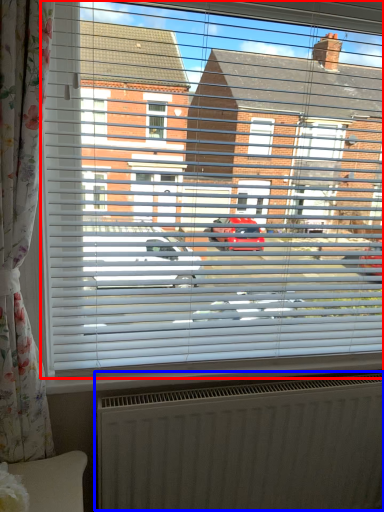
Question: Which object appears closest to the camera in this image, window (highlighted by a red box) or radiator (highlighted by a blue box)?

Choices:
 (A) window
 (B) radiator

Answer: (A)